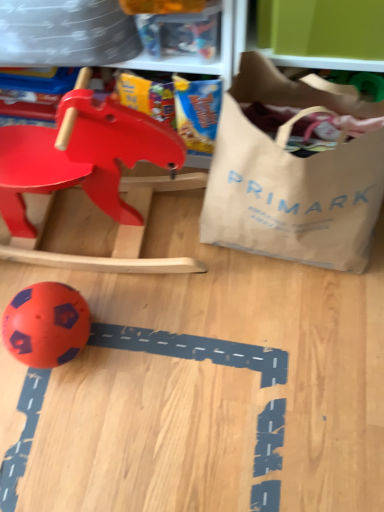
Question: Would you say orange rubber ball at lower left, the 2th toy positioned from the top, is to the left or to the right of matte plastic rocking horse at upper left, the first toy when ordered from top to bottom, in the picture?

Choices:
 (A) right
 (B) left

Answer: (B)

Question: Considering their positions, is orange rubber ball at lower left, positioned as the first toy in bottom-to-top order, located in front of or behind matte plastic rocking horse at upper left, the first toy when ordered from top to bottom?

Choices:
 (A) front
 (B) behind

Answer: (B)

Question: Which is farther from the brown paper bag at right?

Choices:
 (A) matte plastic rocking horse at upper left, placed as the second toy when sorted from bottom to top
 (B) orange rubber ball at lower left, the 2th toy positioned from the top

Answer: (B)

Question: Estimate the real-world distances between objects in this image. Which object is closer to the brown paper bag at right?

Choices:
 (A) matte plastic rocking horse at upper left, the first toy when ordered from top to bottom
 (B) orange rubber ball at lower left, positioned as the first toy in bottom-to-top order

Answer: (A)